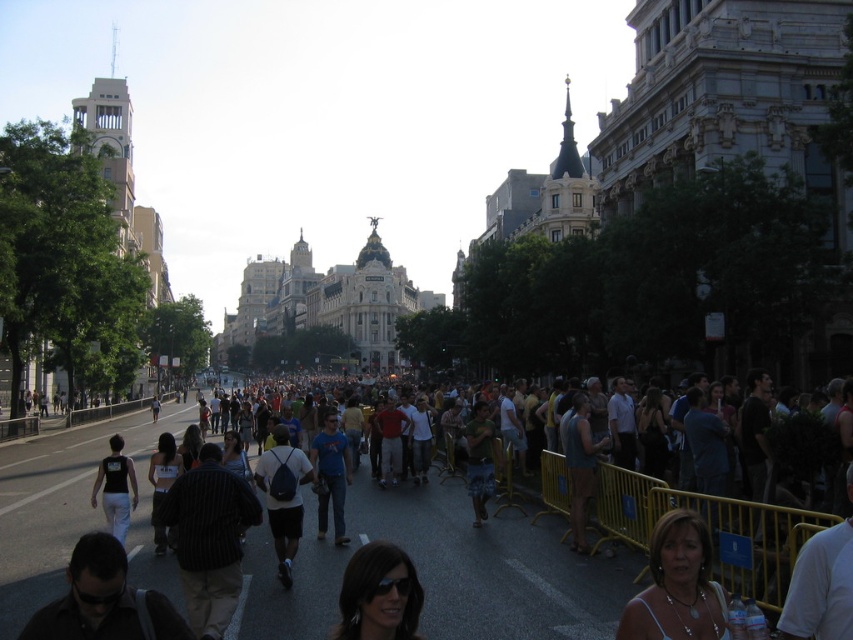
You are a photographer trying to capture a candid shot of the matte blue tank top at center and the black fabric shirt at lower left. Since the scene is crowded, you need to adjust your camera angle. Which object should you focus on first to ensure both are in frame?

The matte blue tank top at center is taller than the black fabric shirt at lower left, so you should focus on the matte blue tank top at center first to ensure both are in frame by adjusting the angle to include the shorter black fabric shirt at lower left.

You are a photographer trying to capture a clear shot of both the dark brown leather jacket at lower left and the matte black sunglasses at lower center. Since you want to ensure both are visible in your frame, which object should you focus on first to account for their size difference?

The dark brown leather jacket at lower left is larger in size than the matte black sunglasses at lower center, so you should focus on the dark brown leather jacket at lower left first as it takes up more space in the frame.

You are a photographer trying to capture a clear shot of the matte white shirt at center and the matte black sunglasses at center. Since the two objects are at the same central position, which one do you think will occupy more space in your photo?

The matte white shirt at center is wider than the matte black sunglasses at center, so it will occupy more space in the photo.